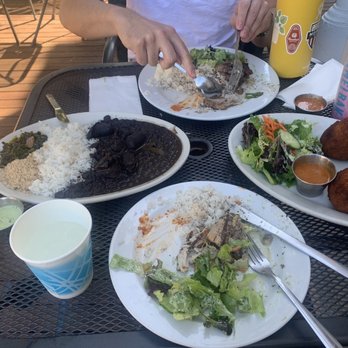
Locate an element on the screen. napkinss is located at coordinates (332, 77), (120, 92).